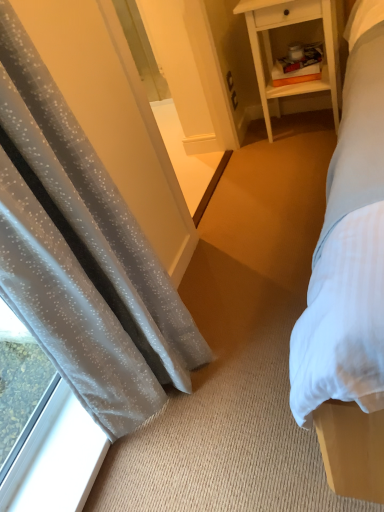
Find the location of `free space that is in between white wood nightstand at upper right and translucent gray curtain at left`. free space that is in between white wood nightstand at upper right and translucent gray curtain at left is located at coordinates tap(263, 224).